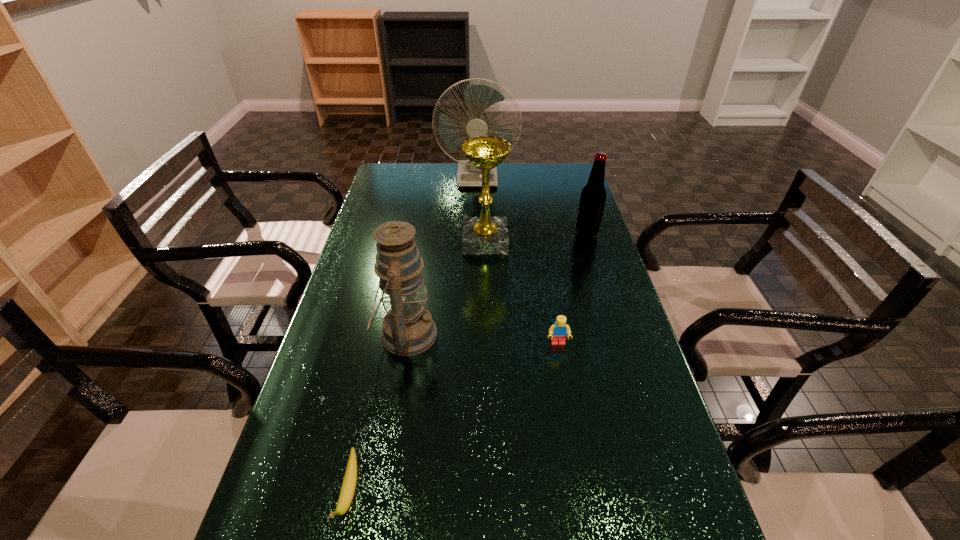
Identify the location of object that is at the right edge. coord(593,196).

Image resolution: width=960 pixels, height=540 pixels. Identify the location of blank area at the left edge. (403, 219).

Locate an element on the screen. Image resolution: width=960 pixels, height=540 pixels. free region at the right edge is located at coordinates (584, 252).

Where is `vacant space at the far right corner of the desktop`? This screenshot has height=540, width=960. vacant space at the far right corner of the desktop is located at coordinates (565, 185).

You are a GUI agent. You are given a task and a screenshot of the screen. Output one action in this format:
    pyautogui.click(x=<x>, y=<y>)
    Task: Click on the empty space between the shortest object and the oil lamp
    The width and height of the screenshot is (960, 540).
    Given the screenshot: What is the action you would take?
    click(x=377, y=414)

In order to click on free space between the third shortest object and the Lego in this screenshot , I will do tap(572, 288).

You are a GUI agent. You are given a task and a screenshot of the screen. Output one action in this format:
    pyautogui.click(x=<x>, y=<y>)
    Task: Click on the empty space that is in between the oil lamp and the farthest object
    Image resolution: width=960 pixels, height=540 pixels.
    Given the screenshot: What is the action you would take?
    pyautogui.click(x=442, y=256)

The width and height of the screenshot is (960, 540). Identify the location of free spot between the third shortest object and the oil lamp. (496, 284).

Where is `free space between the second object from right to left and the rightmost object`? Image resolution: width=960 pixels, height=540 pixels. free space between the second object from right to left and the rightmost object is located at coordinates (572, 288).

Where is `vacant point located between the beer bottle and the shortest object`? vacant point located between the beer bottle and the shortest object is located at coordinates (468, 363).